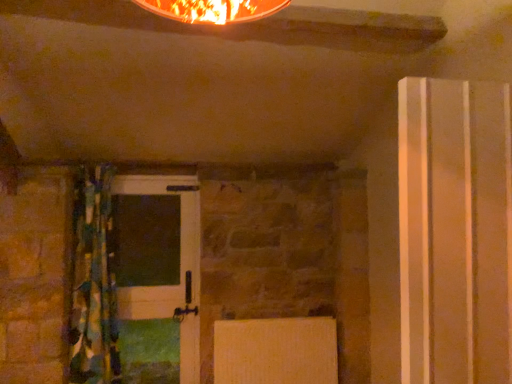
Question: Can you confirm if textured multicolored curtain at left is bigger than white glossy door at center, the 1th door from the back?

Choices:
 (A) no
 (B) yes

Answer: (B)

Question: Would you say textured multicolored curtain at left is outside white glossy door at center, acting as the 2th door starting from the front?

Choices:
 (A) no
 (B) yes

Answer: (B)

Question: Could you tell me if textured multicolored curtain at left is facing white glossy door at center, the 1th door from the back?

Choices:
 (A) yes
 (B) no

Answer: (B)

Question: Can you confirm if textured multicolored curtain at left is shorter than white glossy door at center, the 1th door from the back?

Choices:
 (A) yes
 (B) no

Answer: (B)

Question: Is textured multicolored curtain at left positioned far away from white glossy door at center, the 1th door in the left-to-right sequence?

Choices:
 (A) yes
 (B) no

Answer: (B)

Question: From the image's perspective, is textured multicolored curtain at left above white glossy door at center, the 1th door in the left-to-right sequence?

Choices:
 (A) no
 (B) yes

Answer: (B)

Question: Considering the relative positions of transparent plastic door at right, which is counted as the first door, starting from the right, and white glossy door at center, the 1th door from the back, in the image provided, is transparent plastic door at right, which is counted as the first door, starting from the right, in front of white glossy door at center, the 1th door from the back,?

Choices:
 (A) no
 (B) yes

Answer: (B)

Question: From the image's perspective, would you say transparent plastic door at right, the 1th door when ordered from front to back, is positioned over white glossy door at center, the 2th door viewed from the right?

Choices:
 (A) no
 (B) yes

Answer: (B)

Question: Is transparent plastic door at right, which is the second door in left-to-right order, taller than white glossy door at center, the 1th door in the left-to-right sequence?

Choices:
 (A) yes
 (B) no

Answer: (B)

Question: Does transparent plastic door at right, the 1th door when ordered from front to back, turn towards white glossy door at center, acting as the 2th door starting from the front?

Choices:
 (A) no
 (B) yes

Answer: (A)

Question: Is white glossy door at center, the 1th door from the back, completely or partially inside transparent plastic door at right, the 1th door when ordered from front to back?

Choices:
 (A) yes
 (B) no

Answer: (B)

Question: From a real-world perspective, is transparent plastic door at right, which is counted as the 2th door, starting from the back, positioned over white glossy door at center, the 1th door from the back, based on gravity?

Choices:
 (A) no
 (B) yes

Answer: (B)

Question: From the image's perspective, is transparent plastic door at right, which is counted as the first door, starting from the right, located above textured multicolored curtain at left?

Choices:
 (A) yes
 (B) no

Answer: (A)